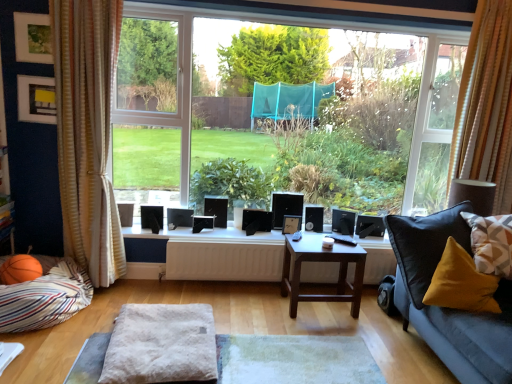
Question: Relative to fuzzy fabric ottoman at center, is dark brown wooden table at center in front or behind?

Choices:
 (A) behind
 (B) front

Answer: (A)

Question: In terms of height, does dark brown wooden table at center look taller or shorter compared to fuzzy fabric ottoman at center?

Choices:
 (A) short
 (B) tall

Answer: (B)

Question: Estimate the real-world distances between objects in this image. Which object is farther from the white matte radiator at center?

Choices:
 (A) fuzzy fabric ottoman at center
 (B) striped fabric curtain at left, the first curtain from the left
 (C) wooden picture frame at center, the third picture frame viewed from the front
 (D) geometric-patterned fabric pillow at right, positioned as the 1th pillow in right-to-left order
 (E) velvet yellow pillow at lower right, acting as the 2th pillow starting from the left

Answer: (D)

Question: Which is nearer to the striped fabric curtain at left, arranged as the second curtain when viewed from the right?

Choices:
 (A) striped fabric pillow at lower left, which ranks as the first pillow in left-to-right order
 (B) matte black picture frame at upper left, acting as the 3th picture frame starting from the right
 (C) wooden picture frame at center, arranged as the 1th picture frame when ordered from the bottom
 (D) matte green picture frame at upper left, placed as the 1th picture frame when sorted from front to back
 (E) velvet yellow pillow at lower right, acting as the 2th pillow starting from the left

Answer: (B)